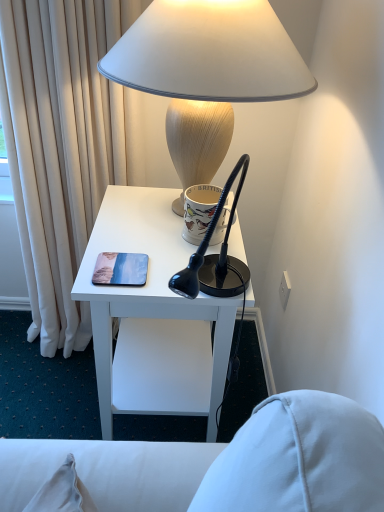
Identify the location of empty space that is ontop of white glossy desk at center (from a real-world perspective). This screenshot has width=384, height=512. (153, 234).